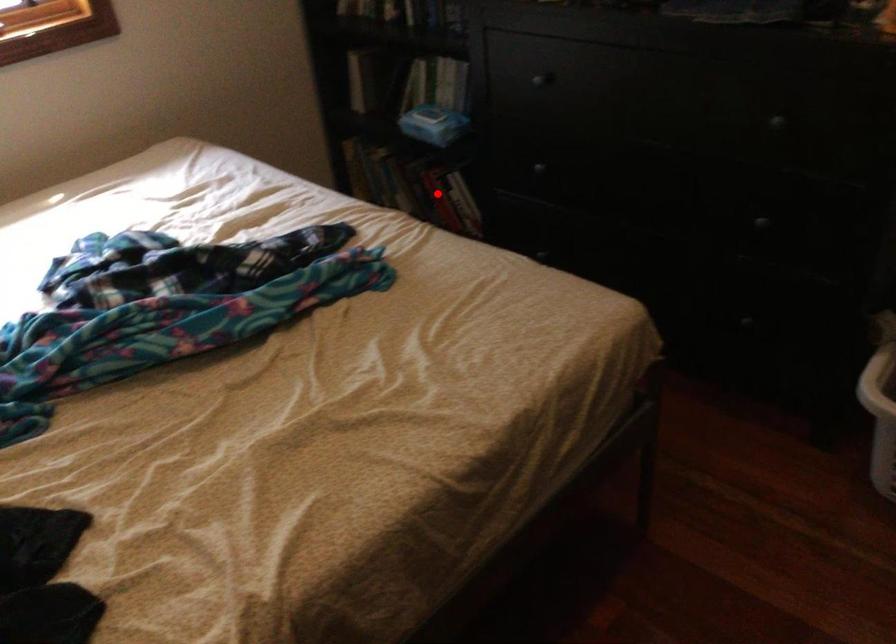
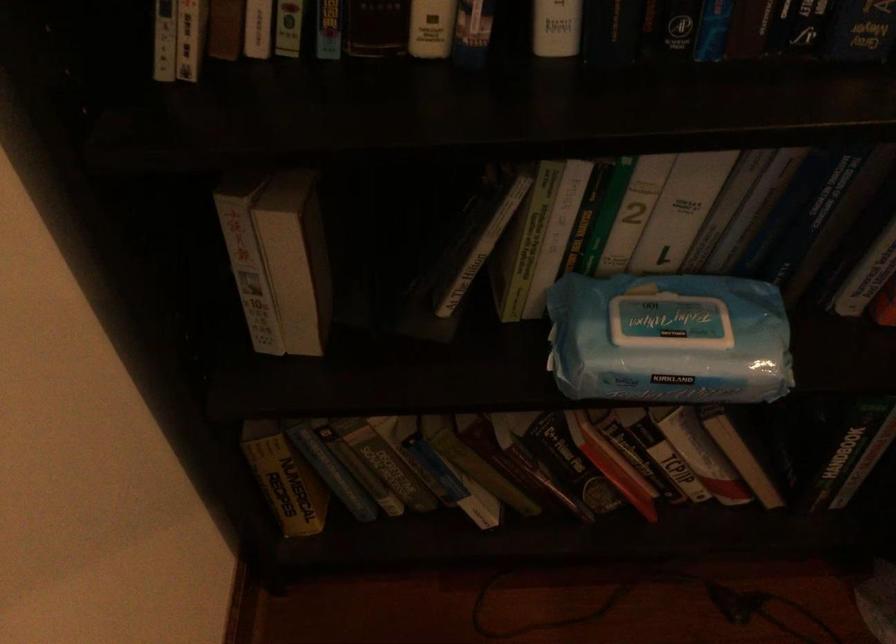
Question: I am providing you with two images of the same scene from different viewpoints. A red point is shown in image1. For the corresponding object point in image2, is it positioned nearer or farther from the camera?

Choices:
 (A) Nearer
 (B) Farther

Answer: (A)